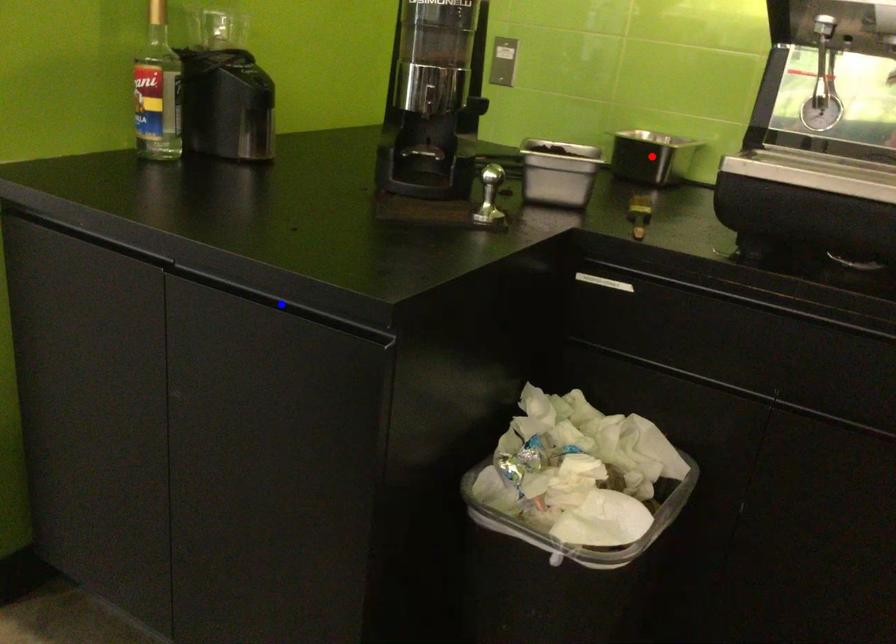
Question: In the image, two points are highlighted. Which point is nearer to the camera? Reply with the corresponding letter.

Choices:
 (A) blue point
 (B) red point

Answer: (A)